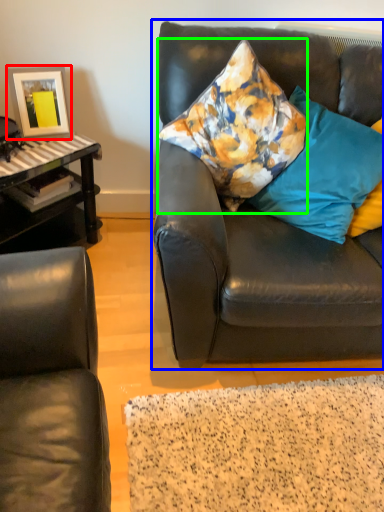
Question: Which object is the closest to the picture frame (highlighted by a red box)? Choose among these: studio couch (highlighted by a blue box) or pillow (highlighted by a green box).

Choices:
 (A) studio couch
 (B) pillow

Answer: (B)